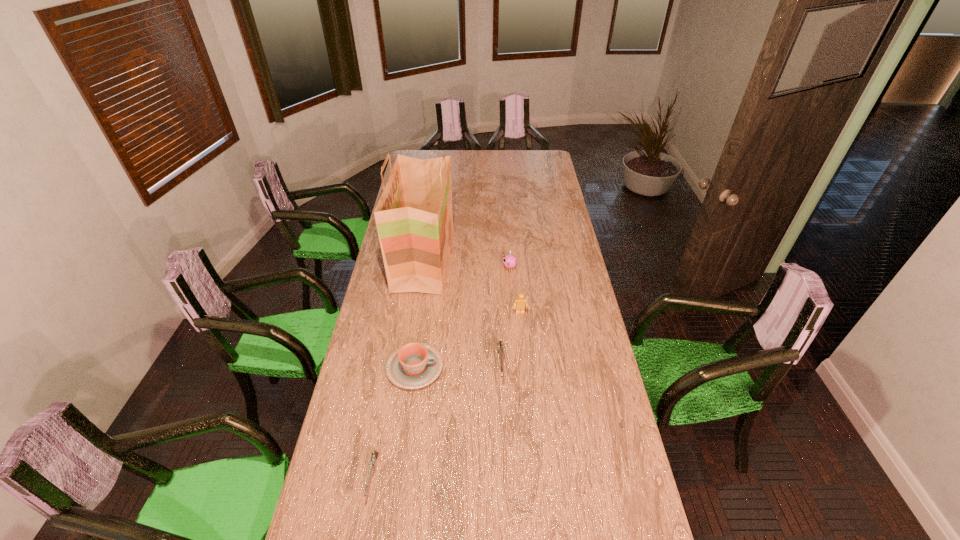
Find the location of a particular element. free space located 0.180m on the face of the cupcake is located at coordinates (464, 268).

Locate an element on the screen. The image size is (960, 540). free spot located on the face of the cupcake is located at coordinates (433, 268).

I want to click on vacant space situated 0.170m on the back of the grocery bag, so click(x=431, y=212).

This screenshot has width=960, height=540. Find the location of `vacant region located on the face of the Lego`. vacant region located on the face of the Lego is located at coordinates (523, 342).

This screenshot has height=540, width=960. Identify the location of vacant area situated 0.140m on the handle side of the chinaware. (481, 368).

You are a GUI agent. You are given a task and a screenshot of the screen. Output one action in this format:
    pyautogui.click(x=<x>, y=<y>)
    Task: Click on the object that is at the near edge
    The height and width of the screenshot is (540, 960).
    Given the screenshot: What is the action you would take?
    pyautogui.click(x=374, y=455)

At what (x,y) coordinates should I click in order to perform the action: click on pistol positioned at the left edge. Please return your answer as a coordinate pair (x, y). Looking at the image, I should click on (374, 455).

At what (x,y) coordinates should I click in order to perform the action: click on grocery bag present at the left edge. Please return your answer as a coordinate pair (x, y). This screenshot has height=540, width=960. Looking at the image, I should click on (414, 216).

This screenshot has height=540, width=960. Identify the location of chinaware situated at the left edge. (415, 365).

What are the coordinates of `object located at the near left corner` in the screenshot? It's located at (374, 455).